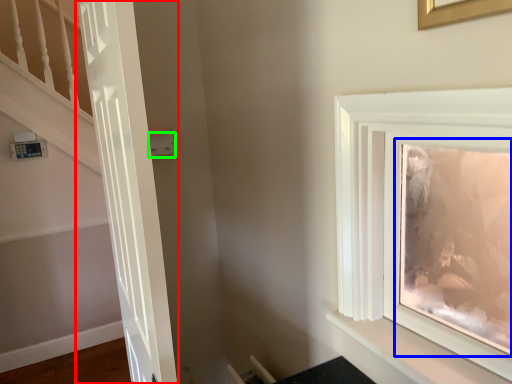
Question: Which object is the farthest from door (highlighted by a red box)? Choose among these: picture frame (highlighted by a blue box) or light switch (highlighted by a green box).

Choices:
 (A) picture frame
 (B) light switch

Answer: (A)